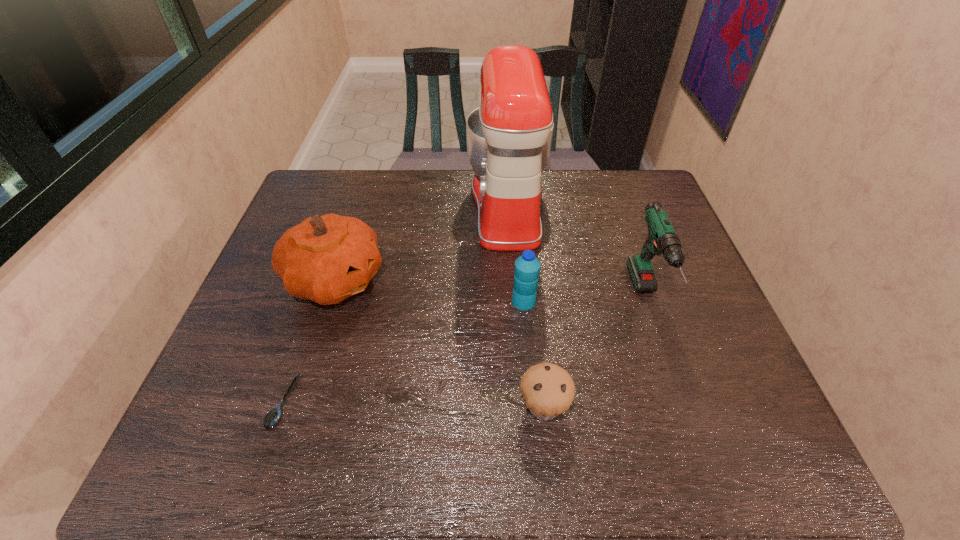
This screenshot has height=540, width=960. In order to click on object present at the near left corner in this screenshot , I will do `click(274, 415)`.

The width and height of the screenshot is (960, 540). Find the location of `free spot at the far edge of the desktop`. free spot at the far edge of the desktop is located at coordinates (452, 180).

Locate an element on the screen. The height and width of the screenshot is (540, 960). vacant area at the near edge is located at coordinates (597, 461).

In the image, there is a desktop. Identify the location of vacant space at the left edge. (285, 304).

Where is `free space at the right edge`? This screenshot has width=960, height=540. free space at the right edge is located at coordinates (632, 248).

At what (x,y) coordinates should I click in order to perform the action: click on vacant area at the far left corner. Please return your answer as a coordinate pair (x, y). Looking at the image, I should click on (347, 179).

Where is `free space between the rightmost object and the soupspoon`? The width and height of the screenshot is (960, 540). free space between the rightmost object and the soupspoon is located at coordinates (465, 350).

The height and width of the screenshot is (540, 960). What are the coordinates of `free area in between the pumpkin and the mixer` in the screenshot? It's located at (421, 242).

Identify the location of free space between the drill and the mixer. This screenshot has height=540, width=960. (577, 252).

This screenshot has height=540, width=960. I want to click on vacant space in between the shortest object and the rightmost object, so click(x=465, y=350).